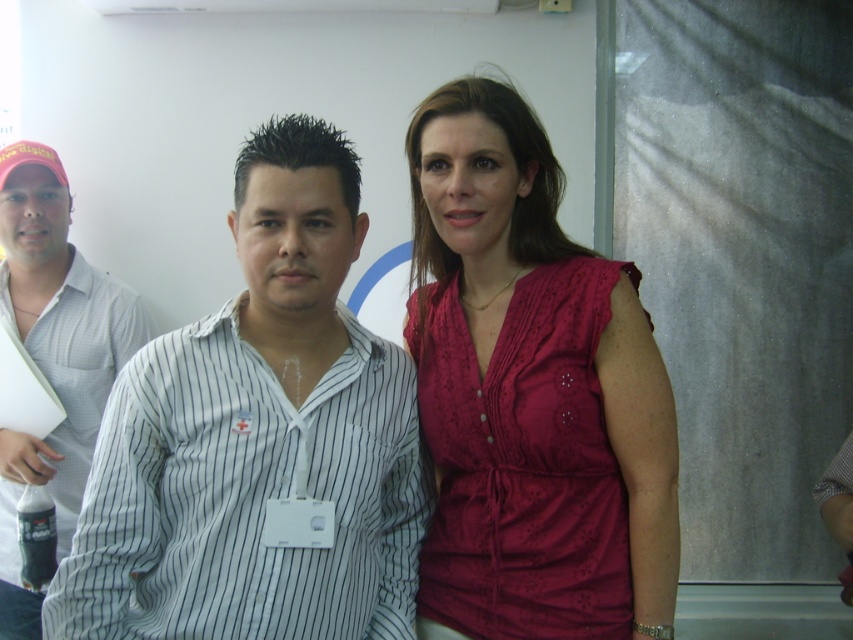
Question: Does white striped shirt at center have a larger size compared to matte pink blouse at center?

Choices:
 (A) yes
 (B) no

Answer: (A)

Question: Which of the following is the closest to the observer?

Choices:
 (A) (450, 260)
 (B) (196, 378)

Answer: (B)

Question: Which point is closer to the camera?

Choices:
 (A) matte pink blouse at center
 (B) white striped shirt at left
 (C) white striped shirt at center

Answer: (C)

Question: Is white striped shirt at center positioned in front of white striped shirt at left?

Choices:
 (A) no
 (B) yes

Answer: (B)

Question: Which of the following is the closest to the observer?

Choices:
 (A) (76, 595)
 (B) (466, 620)
 (C) (45, 330)

Answer: (A)

Question: Can you confirm if white striped shirt at center is positioned above matte pink blouse at center?

Choices:
 (A) no
 (B) yes

Answer: (A)